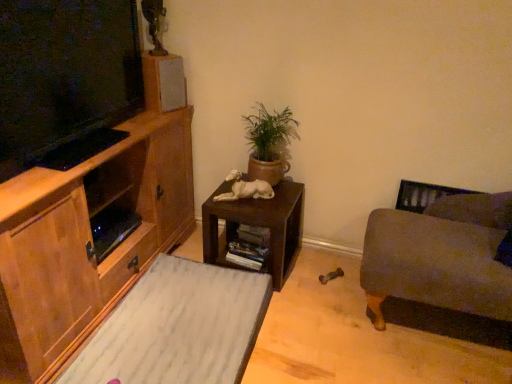
Locate an element on the screen. empty space that is in between dark brown wooden table at center and velvet gray couch at right is located at coordinates (317, 290).